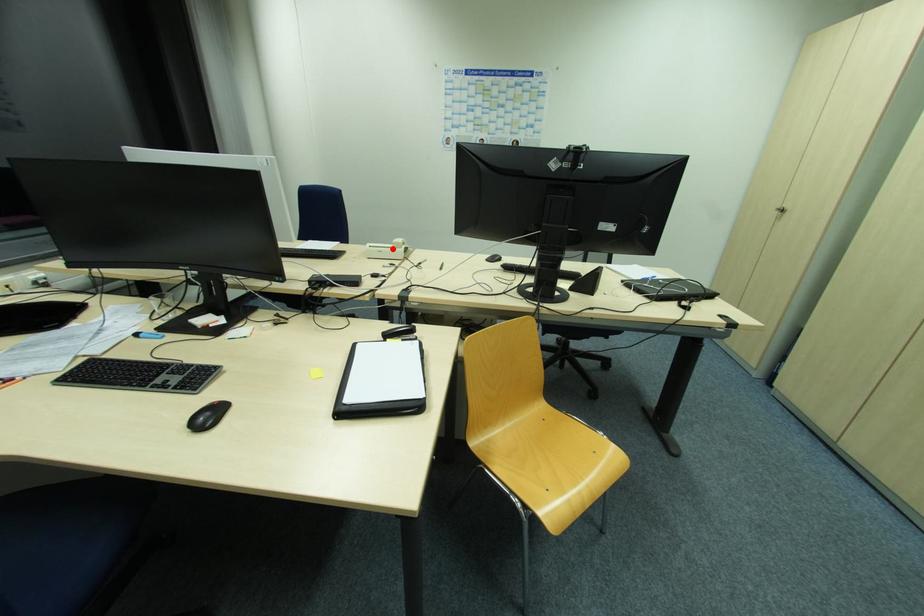
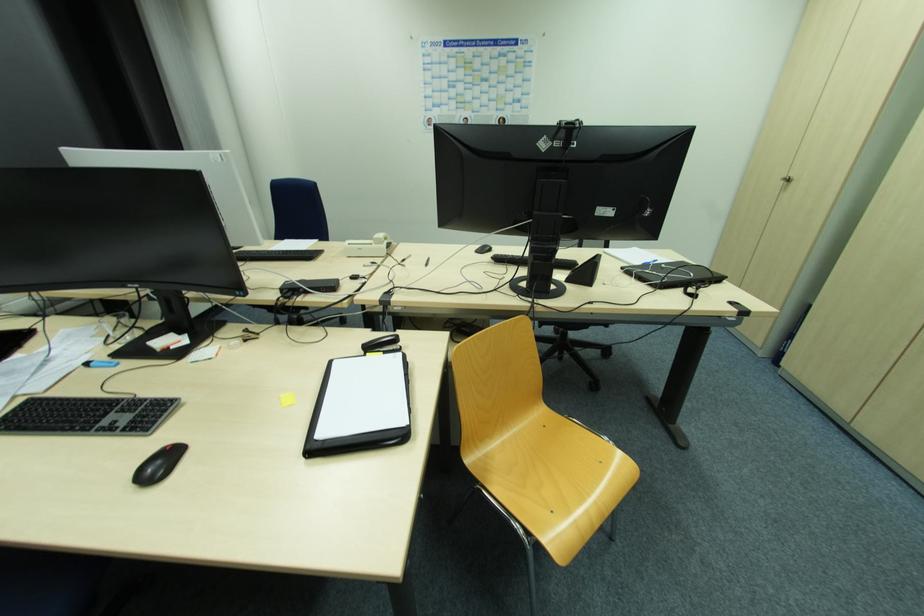
In the second image, find the point that corresponds to the highlighted location in the first image.

(373, 245)